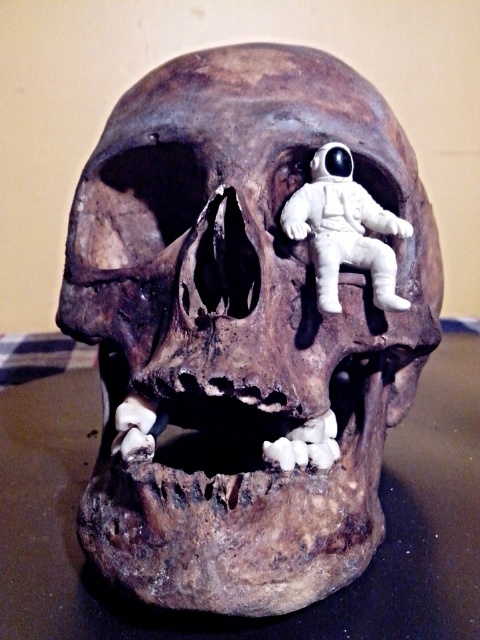
Question: Which point is closer to the camera taking this photo?

Choices:
 (A) (28, 339)
 (B) (315, 440)
 (C) (377, 232)

Answer: (B)

Question: Which of the following is the farthest from the observer?

Choices:
 (A) white matte astronaut at upper center
 (B) brown matte skull at center
 (C) black matte skull at center

Answer: (A)

Question: Can you confirm if black matte skull at center is positioned below white matte astronaut at upper center?

Choices:
 (A) no
 (B) yes

Answer: (B)

Question: From the image, what is the correct spatial relationship of brown matte skull at center in relation to black matte skull at center?

Choices:
 (A) above
 (B) below

Answer: (A)

Question: Is black matte skull at center below white matte astronaut at upper center?

Choices:
 (A) yes
 (B) no

Answer: (A)

Question: Which object is closer to the camera taking this photo?

Choices:
 (A) brown matte skull at center
 (B) black matte skull at center
 (C) white matte astronaut at upper center

Answer: (A)